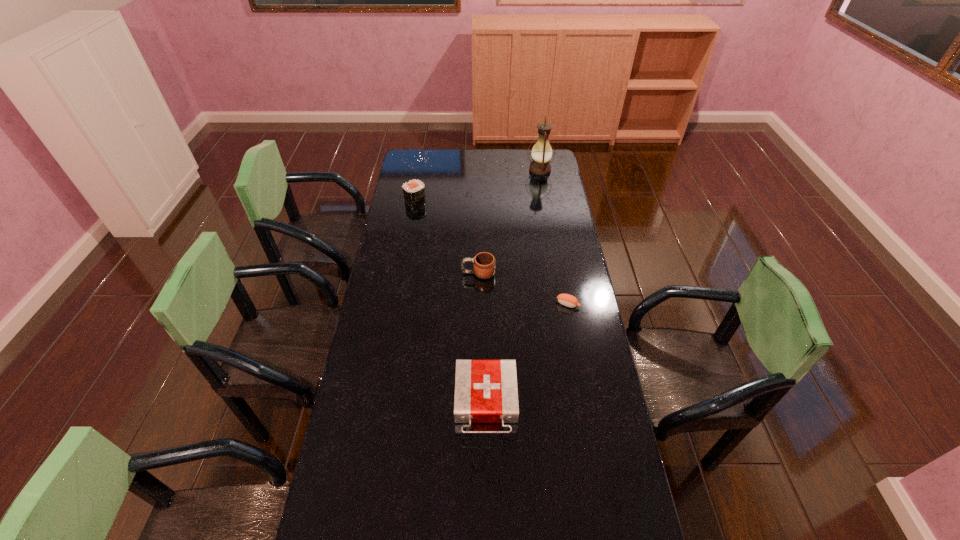
Where is `vacant space located on the left of the tallest object`? The width and height of the screenshot is (960, 540). vacant space located on the left of the tallest object is located at coordinates (516, 170).

This screenshot has height=540, width=960. Find the location of `vacant space positioned 0.320m on the front of the farther sushi`. vacant space positioned 0.320m on the front of the farther sushi is located at coordinates (406, 252).

Where is `vacant region located on the side of the third nearest object with the handle`? This screenshot has width=960, height=540. vacant region located on the side of the third nearest object with the handle is located at coordinates (377, 273).

You are a GUI agent. You are given a task and a screenshot of the screen. Output one action in this format:
    pyautogui.click(x=<x>, y=<y>)
    Task: Click on the vacant area located 0.200m on the side of the third nearest object with the handle
    The width and height of the screenshot is (960, 540).
    Given the screenshot: What is the action you would take?
    pyautogui.click(x=414, y=273)

Image resolution: width=960 pixels, height=540 pixels. Find the location of `free location located 0.180m on the side of the third nearest object with the handle`. free location located 0.180m on the side of the third nearest object with the handle is located at coordinates tap(419, 273).

At what (x,y) coordinates should I click in order to perform the action: click on free space located on the front side of the fourth tallest object. Please return your answer as a coordinate pair (x, y). The height and width of the screenshot is (540, 960). Looking at the image, I should click on (487, 477).

Where is `free region located 0.150m on the back of the shortest object`? free region located 0.150m on the back of the shortest object is located at coordinates (563, 272).

Where is `object present at the far edge`? object present at the far edge is located at coordinates (541, 153).

Where is `object that is at the left edge`? object that is at the left edge is located at coordinates (414, 191).

The height and width of the screenshot is (540, 960). I want to click on oil lamp that is at the right edge, so click(541, 153).